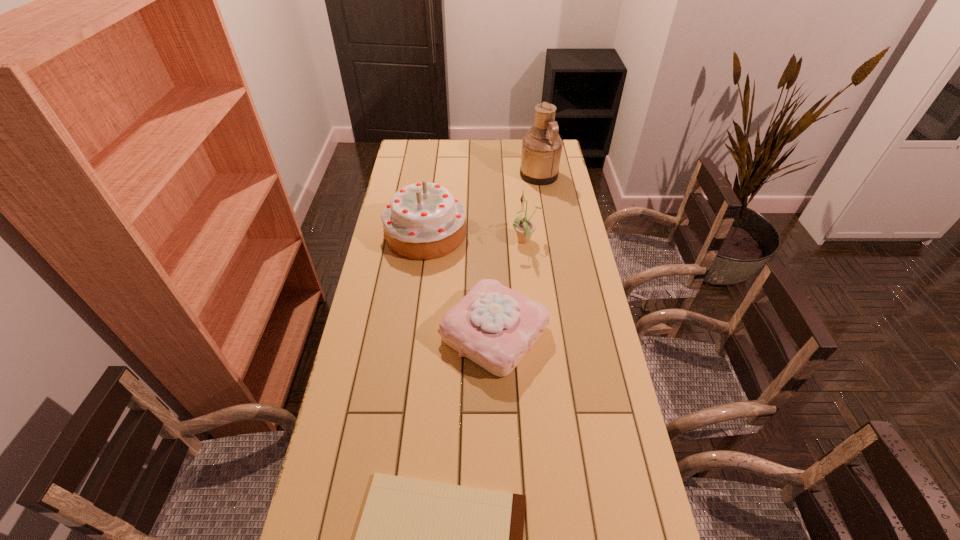
The image size is (960, 540). What are the coordinates of `free space between the fourth tallest object and the sunflower` in the screenshot? It's located at (510, 287).

What are the coordinates of `vacant region between the tallest object and the nearer cake` in the screenshot? It's located at (516, 254).

This screenshot has width=960, height=540. I want to click on vacant point located between the tallest object and the taller cake, so click(x=483, y=204).

Image resolution: width=960 pixels, height=540 pixels. Identify the location of empty space that is in between the tallest object and the farther cake. (483, 204).

The image size is (960, 540). In order to click on blank region between the sunflower and the taller cake in this screenshot , I will do `click(475, 238)`.

You are a GUI agent. You are given a task and a screenshot of the screen. Output one action in this format:
    pyautogui.click(x=<x>, y=<y>)
    Task: Click on the free space between the nearer cake and the sunflower
    This screenshot has height=540, width=960.
    Given the screenshot: What is the action you would take?
    pyautogui.click(x=510, y=287)

Identify the location of blank region between the shorter cake and the tallest object. The height and width of the screenshot is (540, 960). (516, 254).

Locate an element on the screen. Image resolution: width=960 pixels, height=540 pixels. object that is the second closest to the sunflower is located at coordinates (494, 326).

I want to click on the third closest object relative to the sunflower, so click(x=541, y=147).

The height and width of the screenshot is (540, 960). Identify the location of vacant space that satisfies the following two spatial constraints: 1. on the front side of the farther cake; 2. on the right side of the shorter cake. (413, 333).